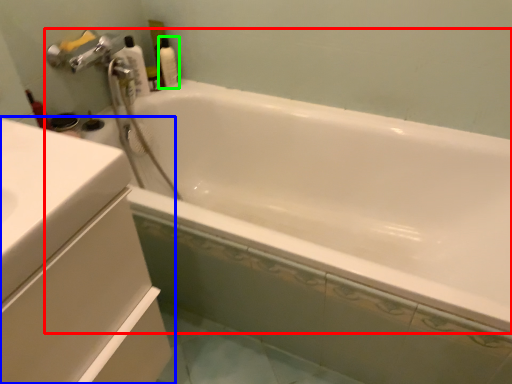
Question: Estimate the real-world distances between objects in this image. Which object is farther from bathtub (highlighted by a red box), bathroom cabinet (highlighted by a blue box) or cleaning product (highlighted by a green box)?

Choices:
 (A) bathroom cabinet
 (B) cleaning product

Answer: (A)